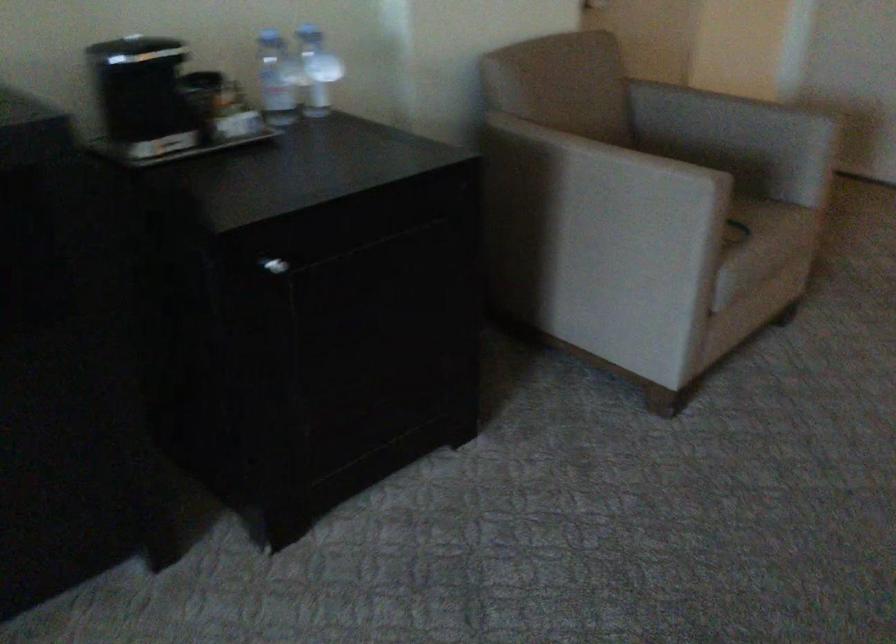
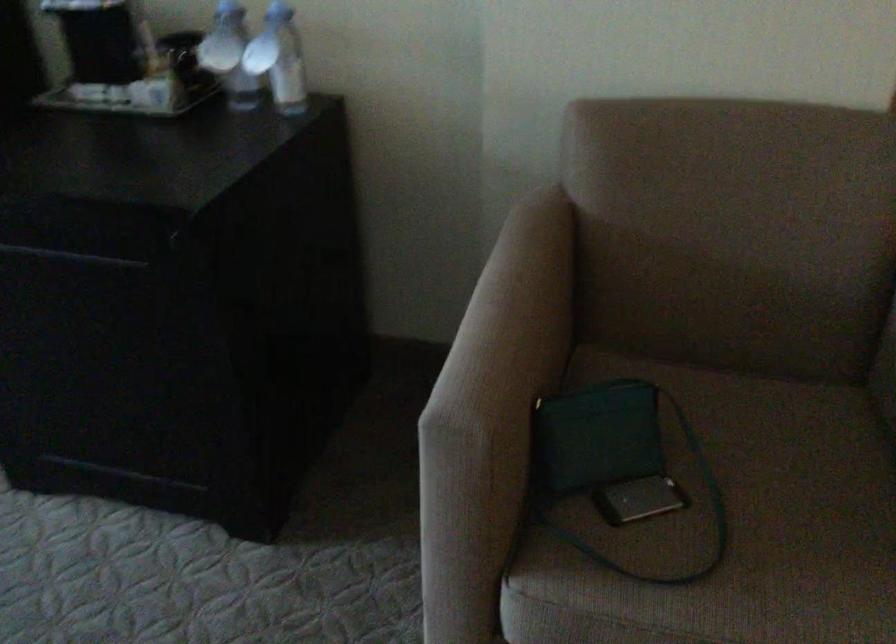
In the second image, find the point that corresponds to [296,78] in the first image.

(229, 55)